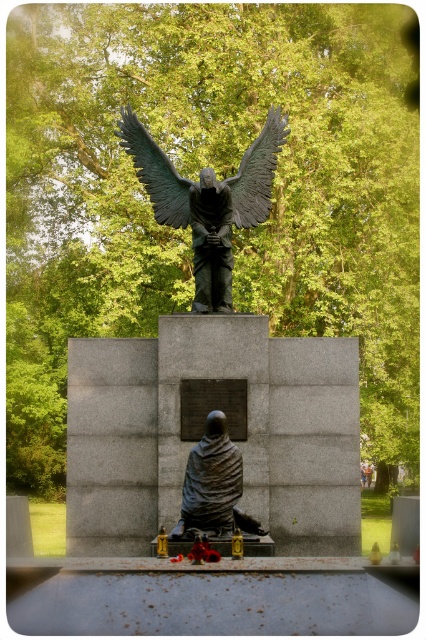
Question: Among these objects, which one is nearest to the camera?

Choices:
 (A) bronze textured eagle at upper center
 (B) green patina wings at upper center
 (C) bronze statue at center
 (D) matte bronze statue at center

Answer: (D)

Question: Does bronze statue at center have a smaller size compared to bronze textured eagle at upper center?

Choices:
 (A) no
 (B) yes

Answer: (A)

Question: Which point is farther to the camera?

Choices:
 (A) bronze statue at center
 (B) matte bronze statue at center
 (C) green patina wings at upper center
 (D) shiny bronze wings at upper center

Answer: (C)

Question: Which object is positioned closest to the shiny bronze wings at upper center?

Choices:
 (A) bronze statue at center
 (B) bronze textured eagle at upper center
 (C) green patina wings at upper center

Answer: (B)

Question: Is matte bronze statue at center further to the viewer compared to shiny bronze wings at upper center?

Choices:
 (A) yes
 (B) no

Answer: (B)

Question: Is bronze textured eagle at upper center thinner than shiny bronze wings at upper center?

Choices:
 (A) no
 (B) yes

Answer: (A)